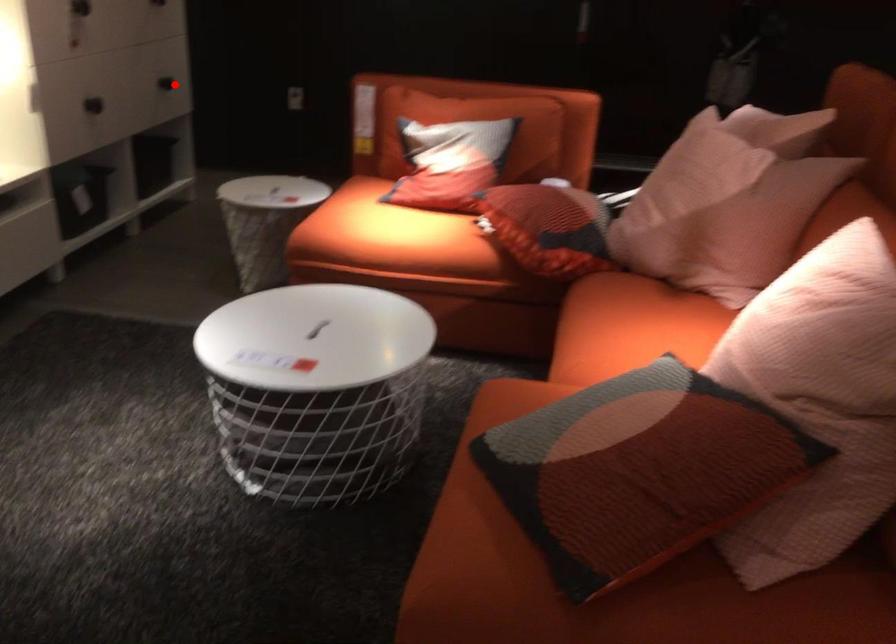
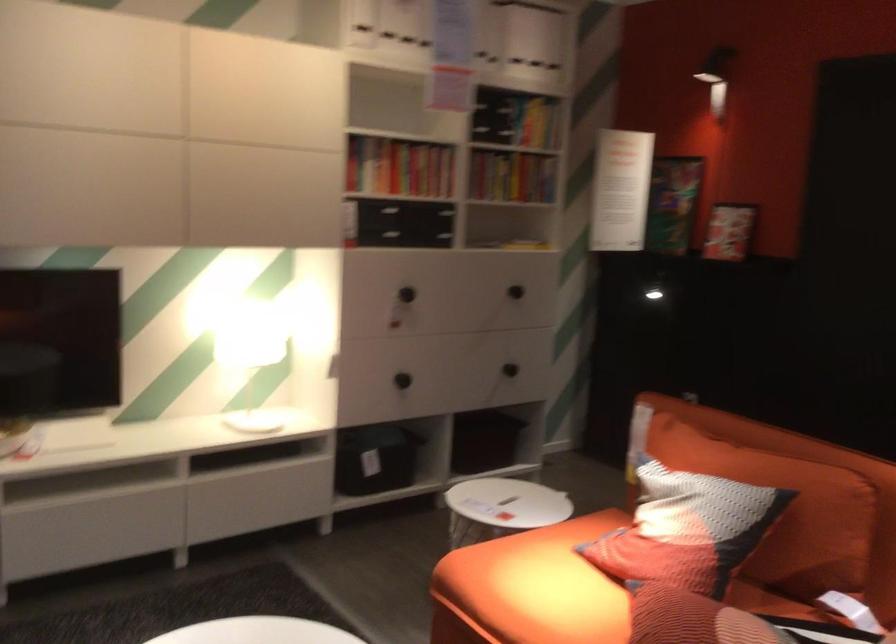
Locate, in the second image, the point that corresponds to the highlighted location in the first image.

(510, 368)